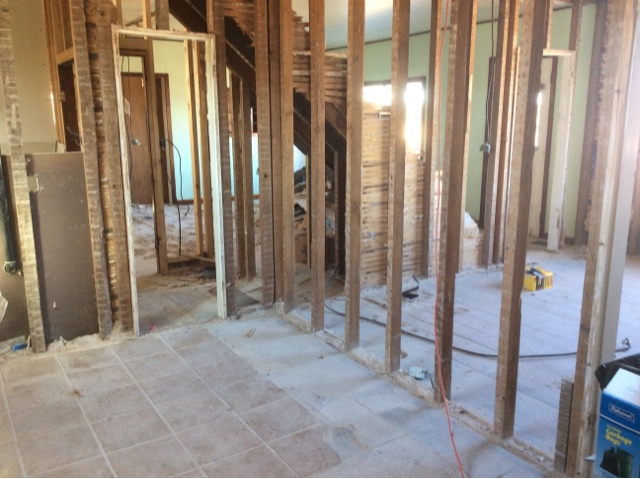
Where is `tile floor`? The height and width of the screenshot is (479, 640). tile floor is located at coordinates (177, 396), (189, 412), (203, 449), (77, 377), (60, 389), (195, 360).